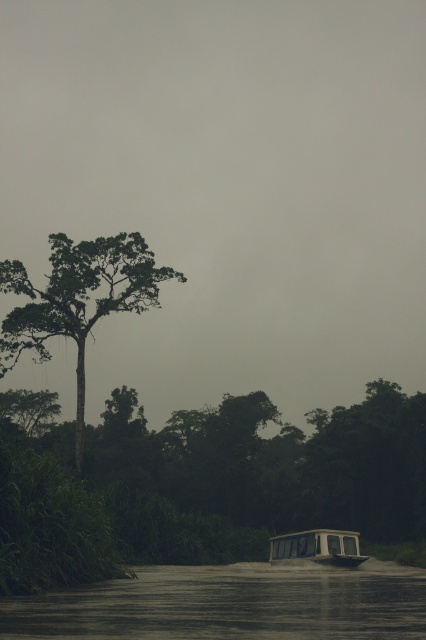
You are an observer standing at the riverbank looking towards the center of the image. You see the green matte tree at upper left and the white plastic boat at lower center. Which object appears wider from your vantage point?

The green matte tree at upper left might be wider than the white plastic boat at lower center according to the description.

You are standing at the edge of the river and want to cross to the other side. The dark water at lower center is your current position. Which direction should you move to reach the tree on the left side?

The dark water at lower center is located at point (230, 604), so you should move to the left to reach the tree on the left side.

From the picture: You are standing at the point with coordinates point (230, 604) in the scene. Based on the description, what is the object located at this point?

The point (230, 604) corresponds to dark water at lower center according to the description.